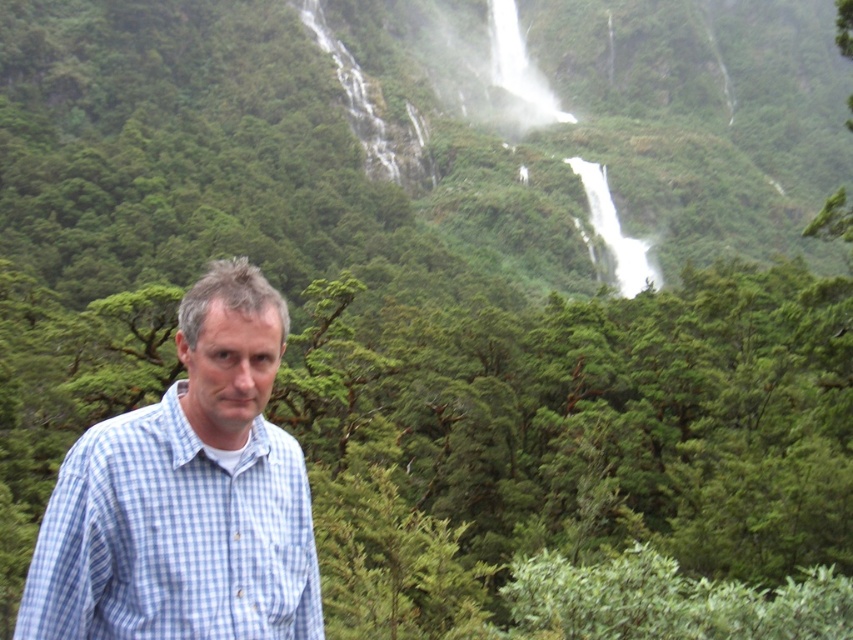
Does blue checkered shirt at center have a greater height compared to white frothy water at upper center?

No, blue checkered shirt at center is not taller than white frothy water at upper center.

Can you confirm if blue checkered shirt at center is thinner than white frothy water at upper center?

No.

Who is more forward, (282, 321) or (611, 220)?

Point (282, 321) is more forward.

Identify the location of blue checkered shirt at center. The width and height of the screenshot is (853, 640). (186, 497).